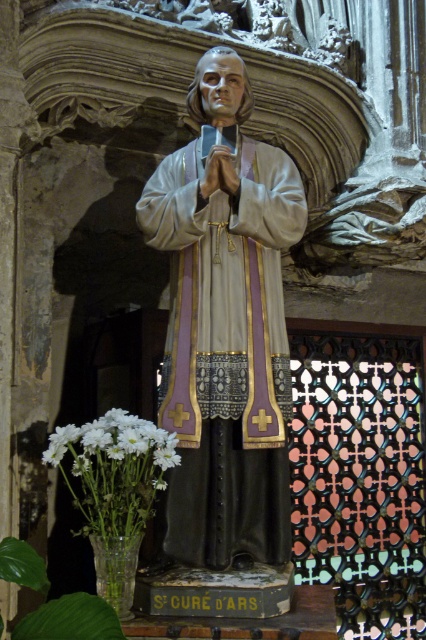
Based on the photo, is the position of matte wood statue at center more distant than that of white matte flowers at lower left?

Yes, matte wood statue at center is further from the viewer.

Which of these two, matte wood statue at center or white matte flowers at lower left, stands taller?

matte wood statue at center

Who is more forward, (233, 225) or (166, 467)?

Point (166, 467) is more forward.

Where is `matte wood statue at center`? This screenshot has width=426, height=640. matte wood statue at center is located at coordinates (226, 348).